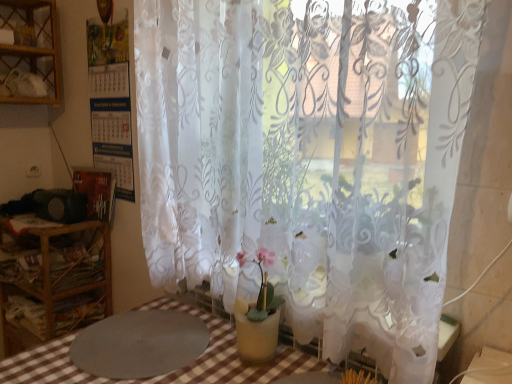
Question: Considering the relative positions of wooden shelf at left and wooden shelf at upper left in the image provided, is wooden shelf at left to the right of wooden shelf at upper left from the viewer's perspective?

Choices:
 (A) no
 (B) yes

Answer: (B)

Question: From a real-world perspective, is wooden shelf at left physically above wooden shelf at upper left?

Choices:
 (A) yes
 (B) no

Answer: (B)

Question: From a real-world perspective, is wooden shelf at left physically below wooden shelf at upper left?

Choices:
 (A) no
 (B) yes

Answer: (B)

Question: Can you confirm if wooden shelf at left is smaller than wooden shelf at upper left?

Choices:
 (A) yes
 (B) no

Answer: (B)

Question: Does wooden shelf at left turn towards wooden shelf at upper left?

Choices:
 (A) yes
 (B) no

Answer: (B)

Question: Considering the relative sizes of wooden shelf at left and wooden shelf at upper left in the image provided, is wooden shelf at left thinner than wooden shelf at upper left?

Choices:
 (A) no
 (B) yes

Answer: (A)

Question: From the image's perspective, is gray textured mat at lower left located beneath wooden shelf at upper left?

Choices:
 (A) no
 (B) yes

Answer: (B)

Question: Does gray textured mat at lower left have a lesser height compared to wooden shelf at upper left?

Choices:
 (A) no
 (B) yes

Answer: (B)

Question: Is wooden shelf at upper left at the back of gray textured mat at lower left?

Choices:
 (A) yes
 (B) no

Answer: (B)

Question: Is gray textured mat at lower left taller than wooden shelf at upper left?

Choices:
 (A) yes
 (B) no

Answer: (B)

Question: From the image's perspective, is gray textured mat at lower left on wooden shelf at upper left?

Choices:
 (A) yes
 (B) no

Answer: (B)

Question: Considering the relative sizes of gray textured mat at lower left and wooden shelf at upper left in the image provided, is gray textured mat at lower left thinner than wooden shelf at upper left?

Choices:
 (A) yes
 (B) no

Answer: (B)

Question: From the image's perspective, would you say transparent floral-patterned curtain at center is positioned over wooden shelf at left?

Choices:
 (A) no
 (B) yes

Answer: (B)